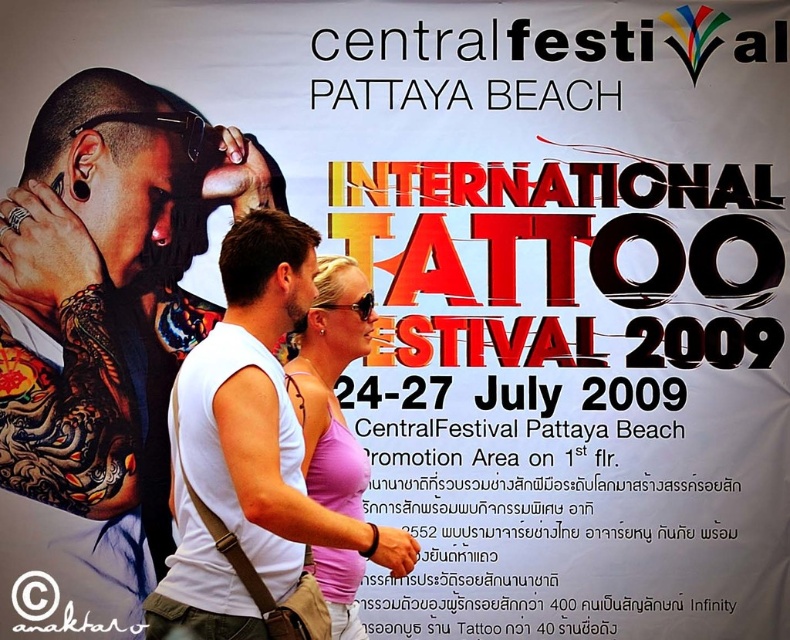
Question: Which point is closer to the camera taking this photo?

Choices:
 (A) (171, 257)
 (B) (337, 609)

Answer: (B)

Question: Which of the following is the closest to the observer?

Choices:
 (A) pink fabric tank top at center
 (B) white matte tank top at center

Answer: (A)

Question: Is white matte tank top at center below pink fabric tank top at center?

Choices:
 (A) no
 (B) yes

Answer: (A)

Question: Can you confirm if white matte tank top at center is bigger than pink fabric tank top at center?

Choices:
 (A) no
 (B) yes

Answer: (B)

Question: Does white matte tank top at center appear on the right side of pink fabric tank top at center?

Choices:
 (A) yes
 (B) no

Answer: (B)